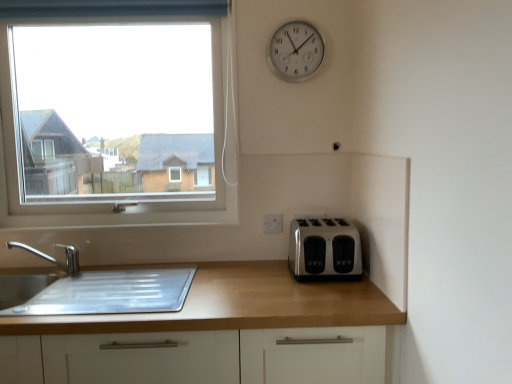
Question: Is point (265, 215) positioned closer to the camera than point (77, 253)?

Choices:
 (A) farther
 (B) closer

Answer: (B)

Question: From a real-world perspective, is white plastic electric outlet at center positioned above or below silver metallic faucet at lower left?

Choices:
 (A) below
 (B) above

Answer: (B)

Question: Based on their relative distances, which object is farther from the silver metallic clock at upper right?

Choices:
 (A) silver metallic faucet at lower left
 (B) clear glass window at upper left
 (C) wooden at right
 (D) satin silver toaster at lower right
 (E) white plastic electric outlet at center

Answer: (B)

Question: Which object is the closest to the white plastic electric outlet at center?

Choices:
 (A) clear glass window at upper left
 (B) wooden at right
 (C) silver metallic clock at upper right
 (D) silver metallic faucet at lower left
 (E) satin silver toaster at lower right

Answer: (E)